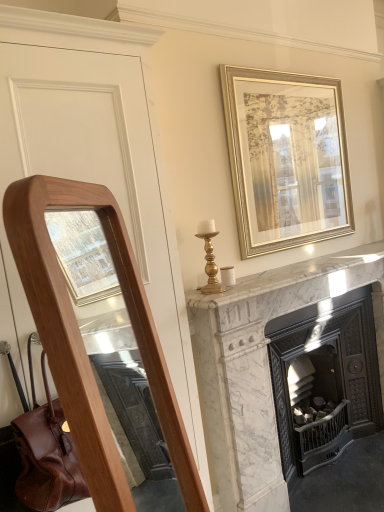
Locate an element on the screen. vacant point above gold metallic picture frame at upper center (from a real-world perspective) is located at coordinates (283, 71).